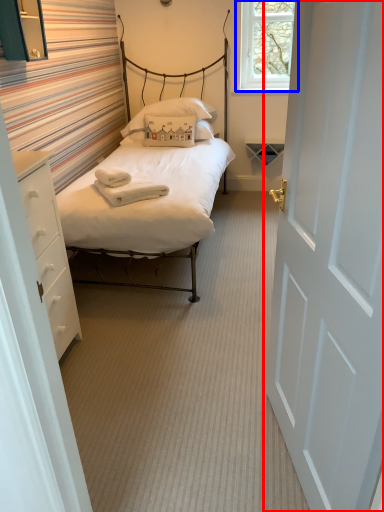
Question: Which object is further to the camera taking this photo, door (highlighted by a red box) or window (highlighted by a blue box)?

Choices:
 (A) door
 (B) window

Answer: (B)